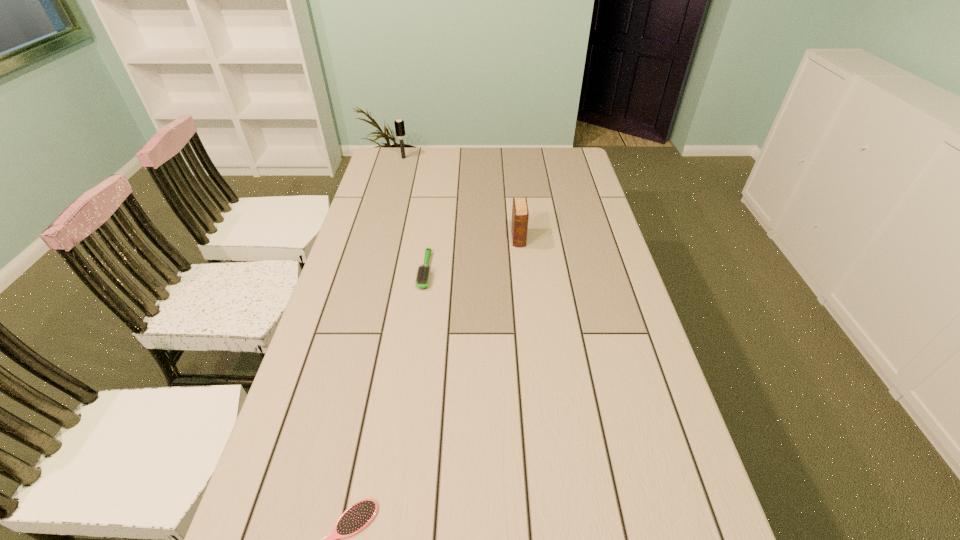
You are a GUI agent. You are given a task and a screenshot of the screen. Output one action in this format:
    pyautogui.click(x=<x>, y=<y>)
    Task: Click on the object present at the left edge
    This screenshot has height=540, width=960.
    Given the screenshot: What is the action you would take?
    pyautogui.click(x=399, y=124)

The height and width of the screenshot is (540, 960). What are the coordinates of `object present at the far left corner` in the screenshot? It's located at (399, 124).

In the image, there is a desktop. Identify the location of blank space at the far edge. This screenshot has height=540, width=960. (420, 172).

Where is `free space at the left edge of the desktop`? free space at the left edge of the desktop is located at coordinates (364, 266).

Identify the location of vacant space at the right edge of the desktop. This screenshot has width=960, height=540. (578, 296).

Locate an element on the screen. This screenshot has width=960, height=540. vacant space at the far left corner is located at coordinates 396,164.

You are a GUI agent. You are given a task and a screenshot of the screen. Output one action in this format:
    pyautogui.click(x=<x>, y=<y>)
    Task: Click on the blank space at the far right corner
    The width and height of the screenshot is (960, 540).
    Given the screenshot: What is the action you would take?
    pyautogui.click(x=569, y=158)

Identify the location of free space between the third object from left to right and the tallest object. The width and height of the screenshot is (960, 540). (414, 214).

Where is `empty location between the second farthest object and the farthest hairbrush`? The width and height of the screenshot is (960, 540). empty location between the second farthest object and the farthest hairbrush is located at coordinates (461, 198).

At what (x,y) coordinates should I click in order to perform the action: click on vacant space that is in between the rightmost object and the second shortest object. Please return your answer as a coordinate pair (x, y). The width and height of the screenshot is (960, 540). Looking at the image, I should click on (471, 254).